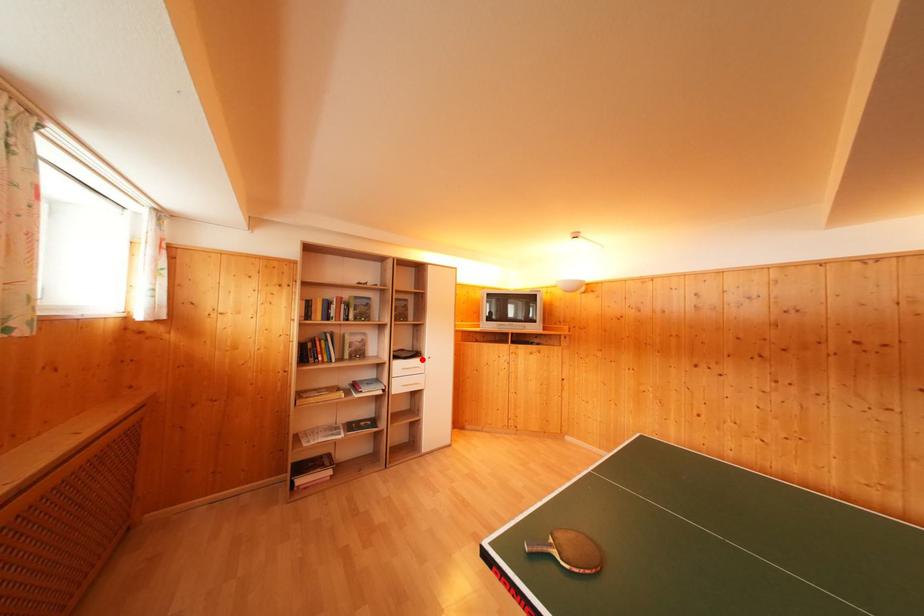
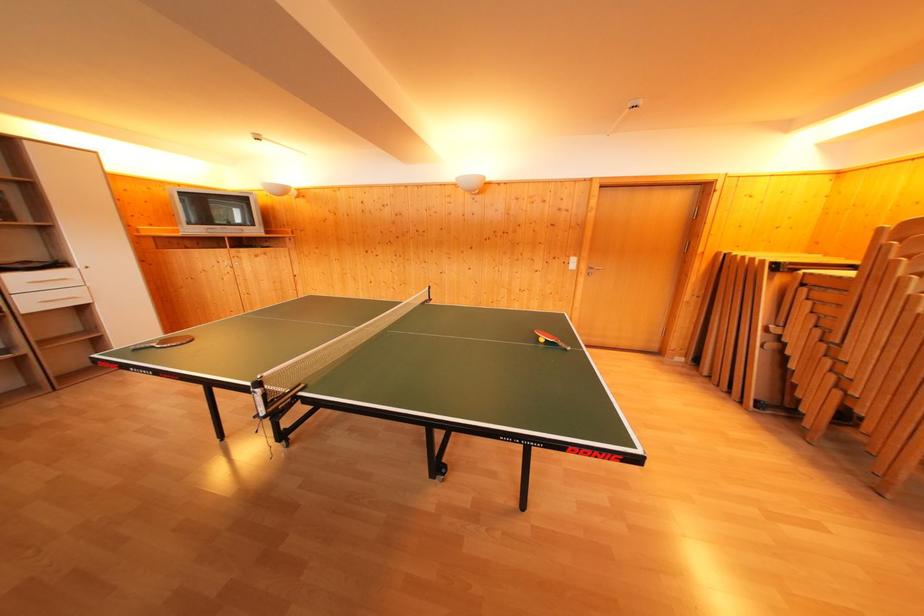
In the second image, find the point that corresponds to the highlighted location in the first image.

(64, 270)